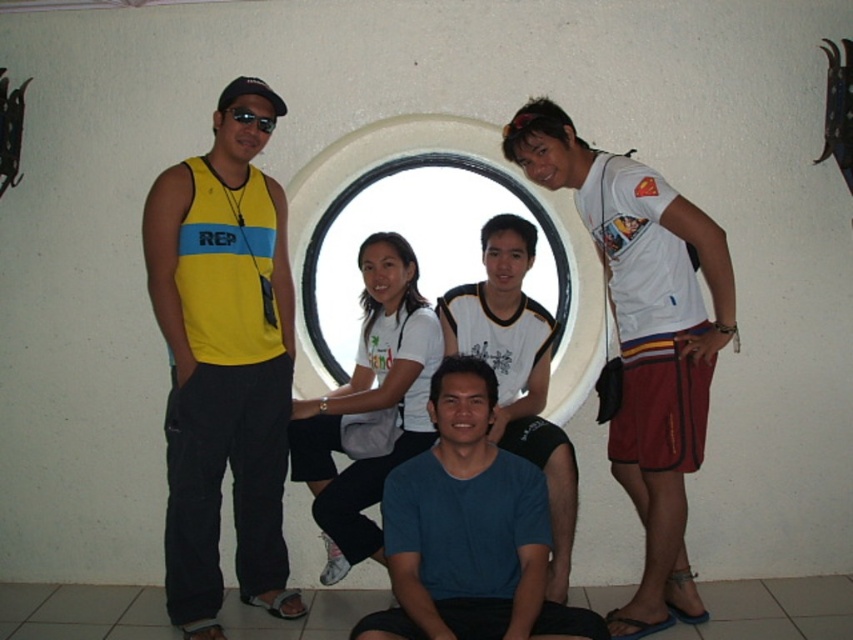
Question: Is yellow fabric tank top at left wider than black reflective sunglasses at upper center?

Choices:
 (A) yes
 (B) no

Answer: (A)

Question: Does yellow fabric tank top at left have a lesser width compared to white cotton shirt at center?

Choices:
 (A) no
 (B) yes

Answer: (B)

Question: Which object is closer to the camera taking this photo?

Choices:
 (A) white cotton shirt at center
 (B) black reflective sunglasses at upper center
 (C) blue matte shirt at center
 (D) yellow fabric tank top at left

Answer: (C)

Question: Among these objects, which one is farthest from the camera?

Choices:
 (A) yellow fabric tank top at left
 (B) blue matte shirt at center
 (C) white cotton shirt at center
 (D) black reflective sunglasses at upper center

Answer: (C)

Question: Among these objects, which one is farthest from the camera?

Choices:
 (A) blue cotton shirt at center
 (B) yellow fabric tank top at left
 (C) white cotton shirt at center
 (D) blue matte shirt at center

Answer: (C)

Question: Where is blue cotton shirt at center located in relation to black reflective sunglasses at upper center in the image?

Choices:
 (A) right
 (B) left

Answer: (A)